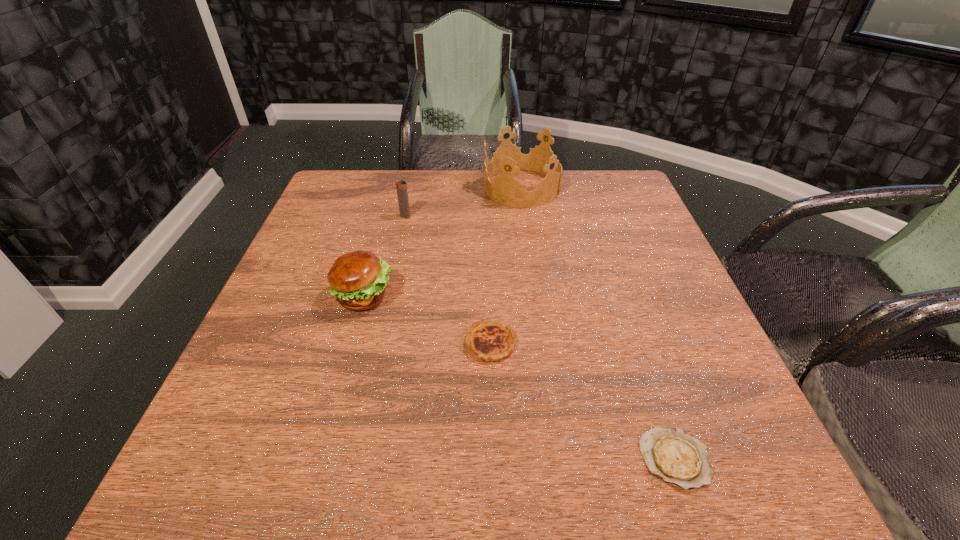
The width and height of the screenshot is (960, 540). What are the coordinates of `free point located 0.130m on the front-facing side of the tallest object` in the screenshot? It's located at (439, 188).

This screenshot has height=540, width=960. Identify the location of vacant space located on the front of the igniter. point(389,289).

Locate an element on the screen. This screenshot has width=960, height=540. blank area located 0.310m on the back of the hamburger is located at coordinates (390, 201).

Where is `free region located 0.220m on the back of the farther quiche`? free region located 0.220m on the back of the farther quiche is located at coordinates (489, 255).

In order to click on vacant position located 0.350m on the left of the rightmost object in this screenshot , I will do `click(415, 458)`.

The image size is (960, 540). I want to click on tiara that is at the far edge, so click(x=505, y=189).

In order to click on igniter that is at the far edge in this screenshot , I will do `click(401, 186)`.

You are a GUI agent. You are given a task and a screenshot of the screen. Output one action in this format:
    pyautogui.click(x=<x>, y=<y>)
    Task: Click on the object situated at the near edge
    The height and width of the screenshot is (540, 960).
    Given the screenshot: What is the action you would take?
    pyautogui.click(x=673, y=455)

Identify the location of object located in the left edge section of the desktop. The width and height of the screenshot is (960, 540). (358, 279).

I want to click on object at the right edge, so click(673, 455).